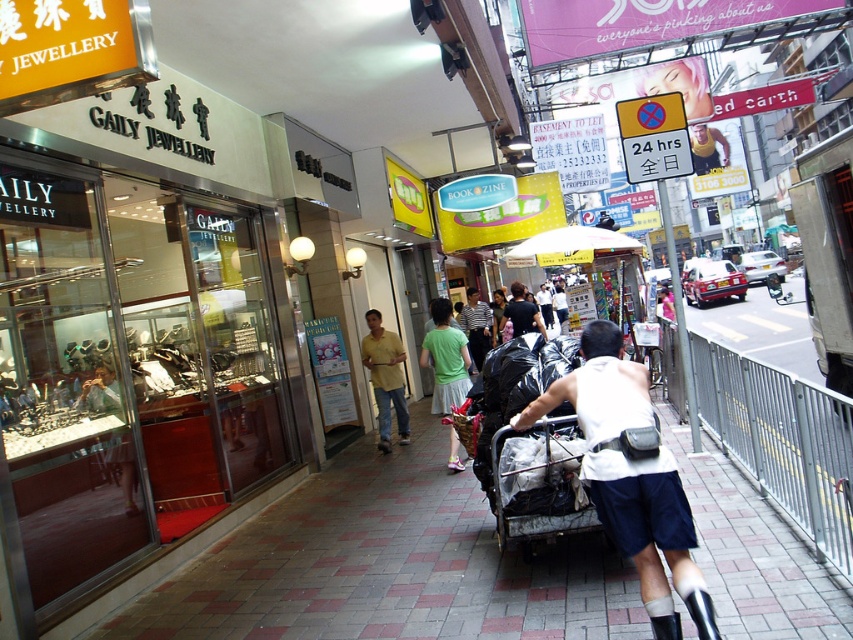
Can you confirm if white fabric shirt at center is thinner than striped cotton shirt at center?

No.

Is white fabric shirt at center closer to the viewer compared to striped cotton shirt at center?

Yes, white fabric shirt at center is in front of striped cotton shirt at center.

Measure the distance between point [650,584] and camera.

Point [650,584] is 9.55 feet away from camera.

Where is `white fabric shirt at center`? The image size is (853, 640). white fabric shirt at center is located at coordinates pyautogui.click(x=631, y=476).

Does black plastic cart at center have a greater height compared to striped cotton shirt at center?

In fact, black plastic cart at center may be shorter than striped cotton shirt at center.

This screenshot has height=640, width=853. Find the location of `black plastic cart at center`. black plastic cart at center is located at coordinates (538, 483).

What do you see at coordinates (538, 483) in the screenshot?
I see `black plastic cart at center` at bounding box center [538, 483].

Find the location of a particular element. black plastic cart at center is located at coordinates (538, 483).

Consider the image. Does striped cotton shirt at center have a lesser height compared to green cotton shirt at center?

No, striped cotton shirt at center is not shorter than green cotton shirt at center.

Does striped cotton shirt at center have a larger size compared to green cotton shirt at center?

Correct, striped cotton shirt at center is larger in size than green cotton shirt at center.

Is point (463, 312) farther from viewer compared to point (527, 312)?

Yes, point (463, 312) is behind point (527, 312).

Locate an element on the screen. striped cotton shirt at center is located at coordinates (476, 326).